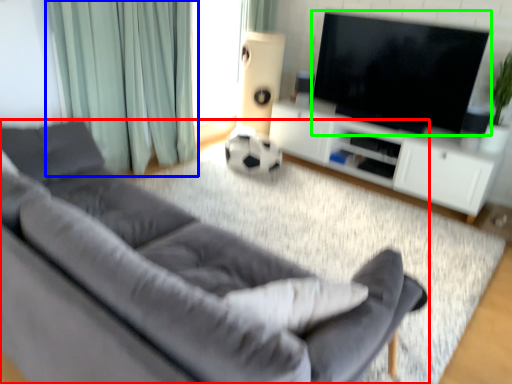
Question: Which is nearer to the studio couch (highlighted by a red box)? curtain (highlighted by a blue box) or television (highlighted by a green box).

Choices:
 (A) curtain
 (B) television

Answer: (A)